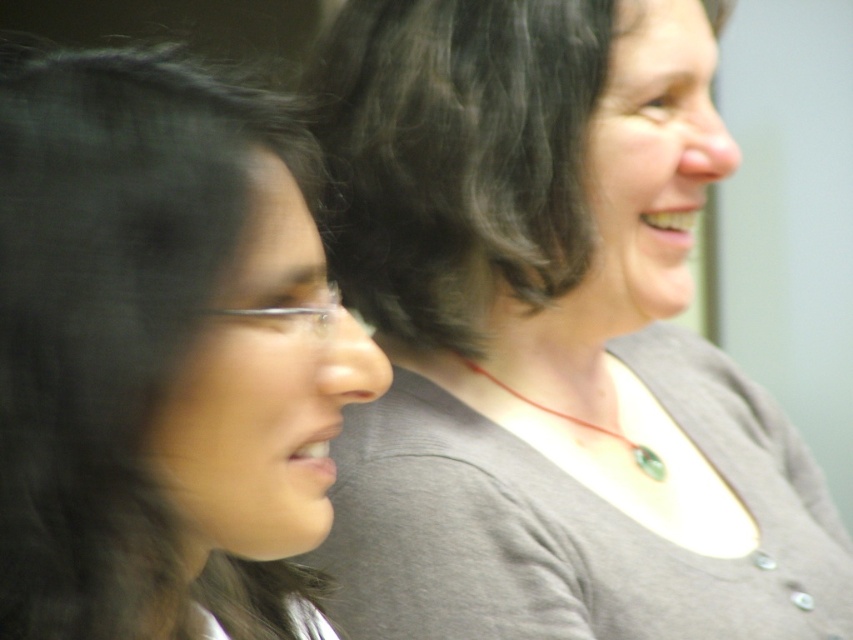
Can you confirm if gray matte shirt at center is positioned below black hair at left?

Incorrect, gray matte shirt at center is not positioned below black hair at left.

Is gray matte shirt at center positioned in front of black hair at left?

No, it is not.

Locate an element on the screen. The height and width of the screenshot is (640, 853). gray matte shirt at center is located at coordinates click(549, 337).

Based on the photo, can you confirm if black hair at left is positioned to the right of dark brown curly hair at upper center?

Incorrect, black hair at left is not on the right side of dark brown curly hair at upper center.

Which is behind, point (271, 140) or point (457, 189)?

Positioned behind is point (457, 189).

What do you see at coordinates (161, 355) in the screenshot? I see `black hair at left` at bounding box center [161, 355].

At what (x,y) coordinates should I click in order to perform the action: click on black hair at left. Please return your answer as a coordinate pair (x, y). Looking at the image, I should click on (161, 355).

Is black hair at left shorter than gray matte necklace at center?

No.

Which of these two, black hair at left or gray matte necklace at center, stands taller?

black hair at left is taller.

Does point (270, 179) come behind point (799, 502)?

No, it is not.

Locate an element on the screen. black hair at left is located at coordinates (161, 355).